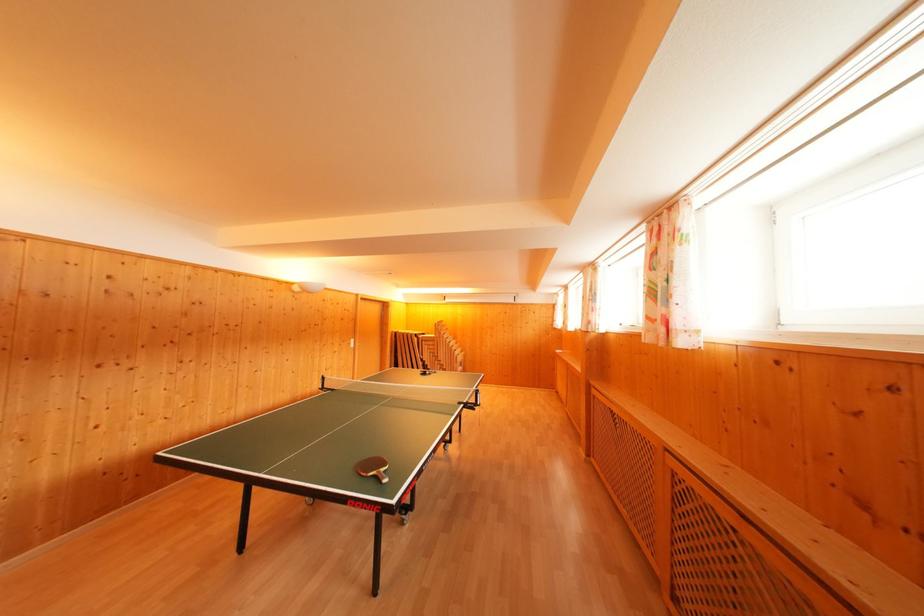
You are a GUI agent. You are given a task and a screenshot of the screen. Output one action in this format:
    pyautogui.click(x=<x>, y=<y>)
    Task: Click on the ping-pong paddle
    This screenshot has width=924, height=616.
    Given the screenshot: What is the action you would take?
    pyautogui.click(x=372, y=468)